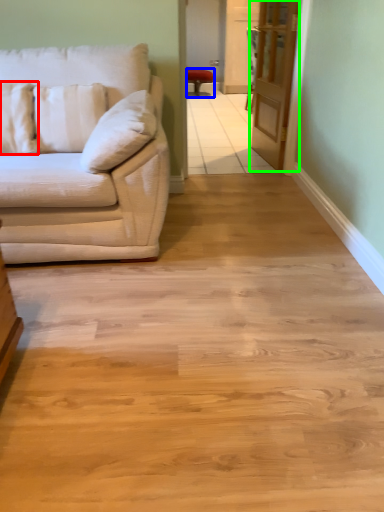
Question: Based on their relative distances, which object is nearer to pillow (highlighted by a red box)? Choose from chair (highlighted by a blue box) and glass door (highlighted by a green box).

Choices:
 (A) chair
 (B) glass door

Answer: (B)